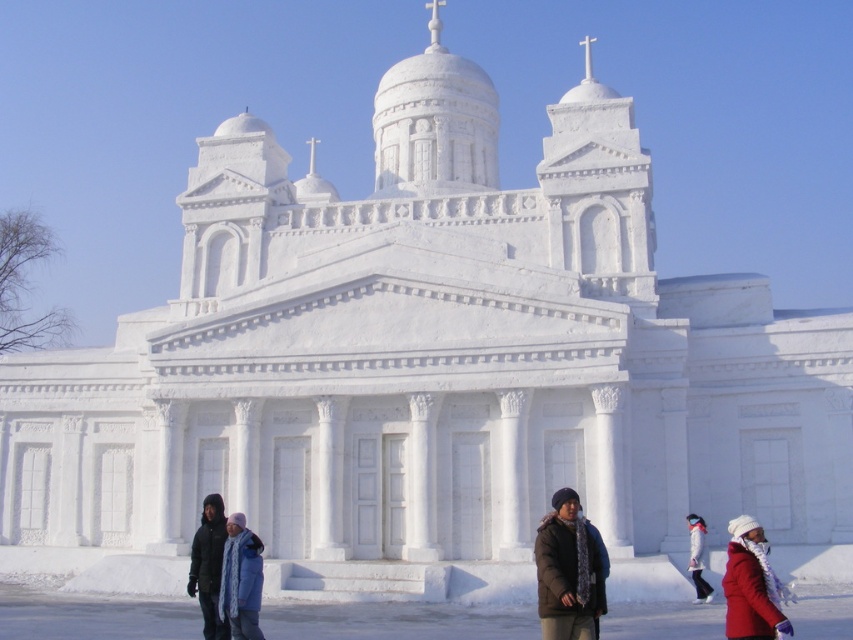
Between dark brown fur coat at center and red woolen scarf at lower right, which one has less height?

red woolen scarf at lower right is shorter.

Can you confirm if dark brown fur coat at center is shorter than red woolen scarf at lower right?

Incorrect, dark brown fur coat at center's height does not fall short of red woolen scarf at lower right's.

Which is in front, point (569, 493) or point (764, 630)?

Positioned in front is point (764, 630).

Locate an element on the screen. The image size is (853, 640). dark brown fur coat at center is located at coordinates (567, 572).

Which is behind, point (749, 582) or point (700, 545)?

Positioned behind is point (700, 545).

Is red woolen scarf at lower right above white woolen hat at lower right?

Yes.

Describe the element at coordinates (750, 584) in the screenshot. This screenshot has height=640, width=853. I see `red woolen scarf at lower right` at that location.

The width and height of the screenshot is (853, 640). What are the coordinates of `red woolen scarf at lower right` in the screenshot? It's located at (750, 584).

Which is below, light blue fabric coat at lower center or white woolen hat at lower right?

Positioned lower is light blue fabric coat at lower center.

Describe the element at coordinates (241, 579) in the screenshot. I see `light blue fabric coat at lower center` at that location.

Between point (244, 618) and point (699, 547), which one is positioned behind?

The point (699, 547) is more distant.

Where is `light blue fabric coat at lower center`? The height and width of the screenshot is (640, 853). light blue fabric coat at lower center is located at coordinates (241, 579).